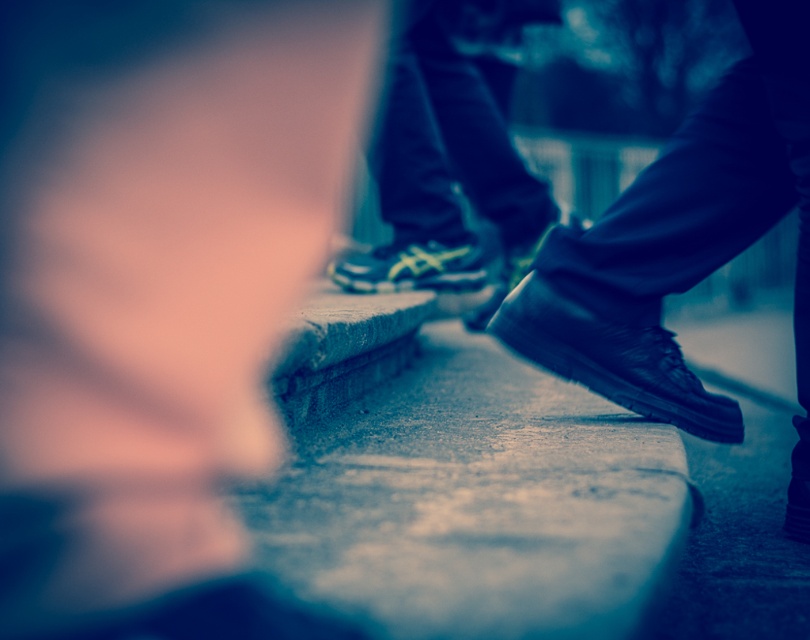
Consider the image. Can you confirm if black leather shoe at lower right is positioned to the right of white mesh shoe at center?

Correct, you'll find black leather shoe at lower right to the right of white mesh shoe at center.

Does black leather shoe at lower right have a larger size compared to white mesh shoe at center?

No.

Locate an element on the screen. The width and height of the screenshot is (810, 640). black leather shoe at lower right is located at coordinates (612, 358).

Can you confirm if white mesh shoe at center is wider than black leather shoe at center?

Yes, white mesh shoe at center is wider than black leather shoe at center.

Is point (418, 280) behind point (534, 250)?

No.

Between point (405, 266) and point (569, 211), which one is positioned behind?

Positioned behind is point (569, 211).

I want to click on white mesh shoe at center, so click(412, 266).

What do you see at coordinates (612, 358) in the screenshot?
I see `black leather shoe at lower right` at bounding box center [612, 358].

The image size is (810, 640). What are the coordinates of `black leather shoe at lower right` in the screenshot? It's located at (612, 358).